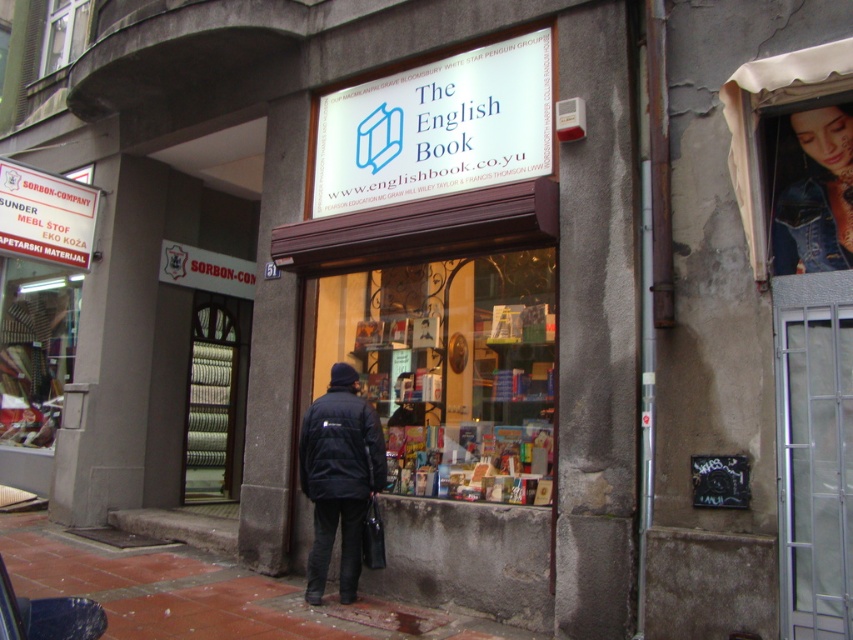
Is brown brick pavement at lower center closer to the viewer compared to white plastic sign at upper left?

Yes, it is in front of white plastic sign at upper left.

Between brown brick pavement at lower center and white plastic sign at upper left, which one appears on the right side from the viewer's perspective?

brown brick pavement at lower center is more to the right.

Which is behind, point (178, 636) or point (82, 256)?

The point (82, 256) is more distant.

Identify the location of brown brick pavement at lower center. (206, 593).

Is black matte jacket at center positioned in front of white plastic sign at upper left?

Yes, black matte jacket at center is in front of white plastic sign at upper left.

Is black matte jacket at center to the left of white plastic sign at upper left from the viewer's perspective?

No, black matte jacket at center is not to the left of white plastic sign at upper left.

Where is `black matte jacket at center`? The image size is (853, 640). black matte jacket at center is located at coordinates (339, 477).

Where is `black matte jacket at center`? Image resolution: width=853 pixels, height=640 pixels. black matte jacket at center is located at coordinates (339, 477).

Is the position of black matte jacket at center less distant than that of denim jacket at upper right?

No, it is not.

Where is `black matte jacket at center`? black matte jacket at center is located at coordinates (339, 477).